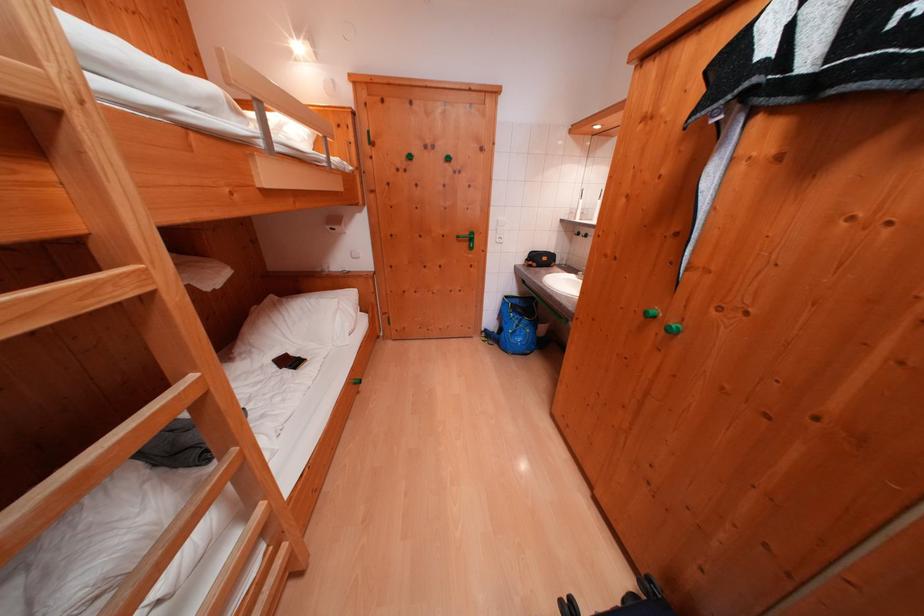
The location [516,326] corresponds to which object?

It corresponds to the black toiletry bag in the image.